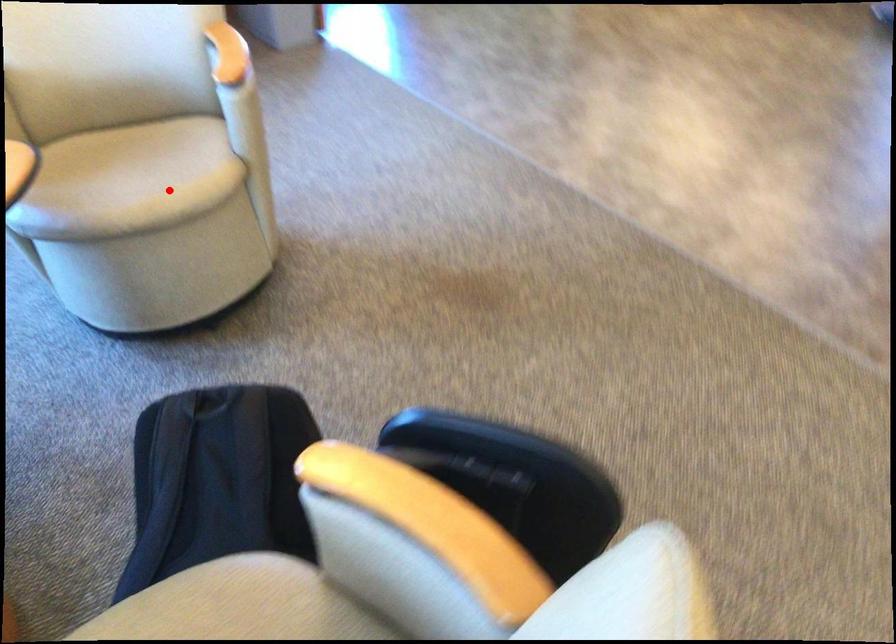
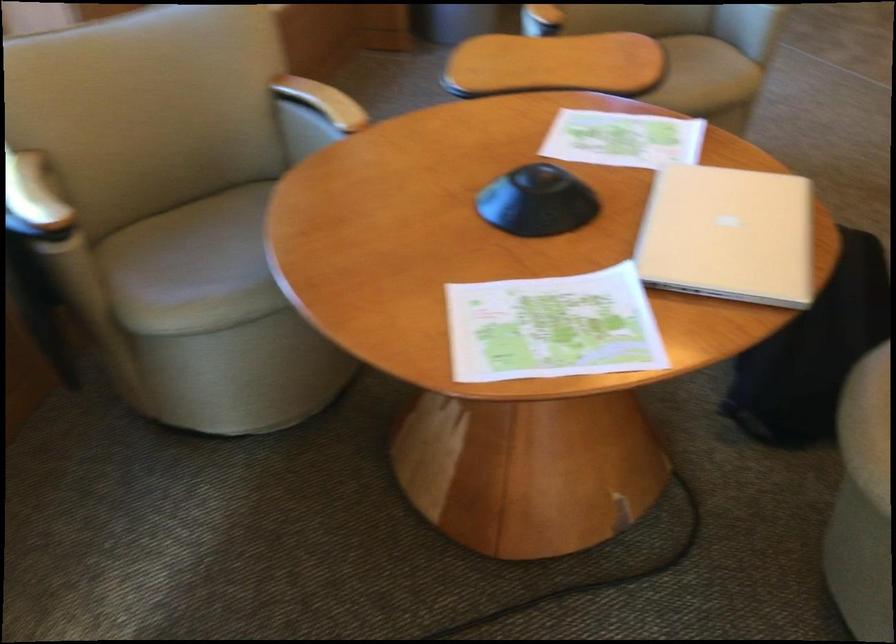
Find the pixel in the second image that matches the highlighted location in the first image.

(703, 76)